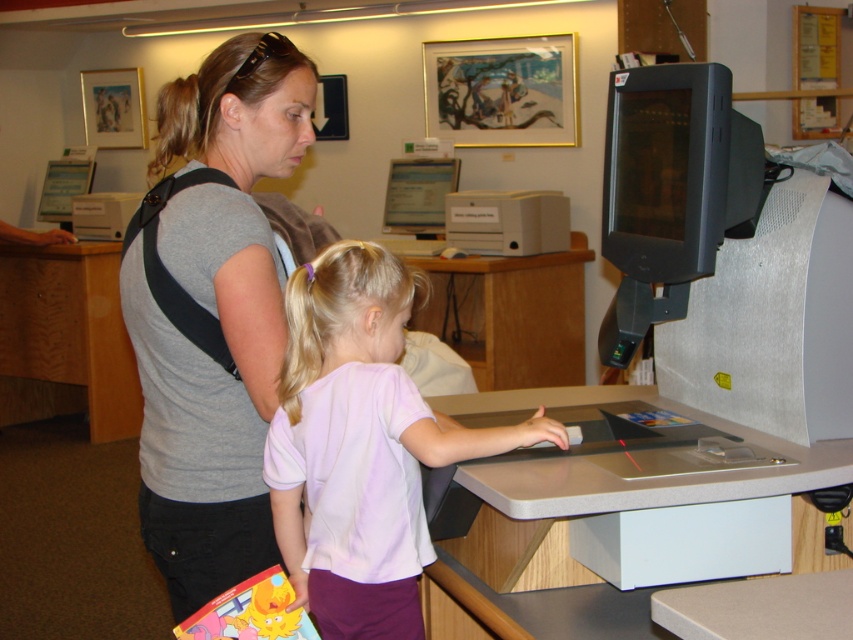
Question: Does gray matte shirt at center appear on the right side of matte plastic monitor at center?

Choices:
 (A) no
 (B) yes

Answer: (A)

Question: Which point is farther to the camera?

Choices:
 (A) matte plastic monitor at center
 (B) gray matte shirt at center

Answer: (A)

Question: Which point appears closest to the camera in this image?

Choices:
 (A) (534, 204)
 (B) (207, 556)

Answer: (B)

Question: Is light purple cotton shirt at center above white plastic printer at center?

Choices:
 (A) no
 (B) yes

Answer: (A)

Question: Which object appears farthest from the camera in this image?

Choices:
 (A) light purple cotton shirt at center
 (B) matte plastic monitor at center

Answer: (B)

Question: Can you confirm if gray matte shirt at center is positioned above matte black monitor at upper center?

Choices:
 (A) no
 (B) yes

Answer: (A)